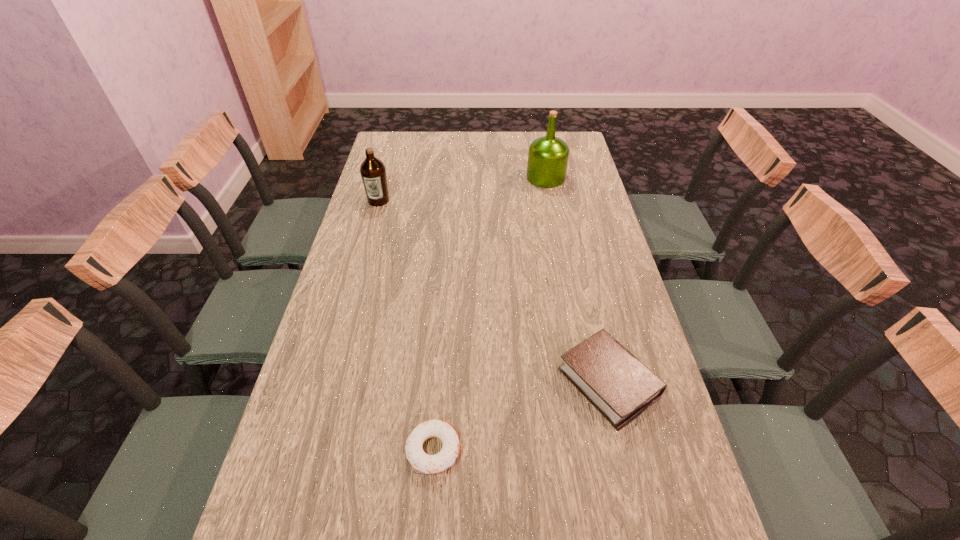
The height and width of the screenshot is (540, 960). What are the coordinates of `vacant space that satisfies the following two spatial constraints: 1. on the label of the shorter olive oil; 2. on the right side of the shortest object` in the screenshot? It's located at (309, 450).

This screenshot has width=960, height=540. I want to click on free space that satisfies the following two spatial constraints: 1. on the front side of the third tallest object; 2. on the right side of the farthest object, so click(x=585, y=382).

I want to click on free location that satisfies the following two spatial constraints: 1. on the label of the third tallest object; 2. on the right side of the third shortest object, so [x=328, y=382].

I want to click on vacant region that satisfies the following two spatial constraints: 1. on the front side of the second shortest object; 2. on the right side of the farthest object, so (585, 382).

At what (x,y) coordinates should I click in order to perform the action: click on blank space that satisfies the following two spatial constraints: 1. on the label of the left olive oil; 2. on the right side of the second shortest object. Please return your answer as a coordinate pair (x, y). The image size is (960, 540). Looking at the image, I should click on (328, 382).

This screenshot has width=960, height=540. Identify the location of free space that satisfies the following two spatial constraints: 1. on the back side of the second shortest object; 2. on the right side of the doughnut. (439, 382).